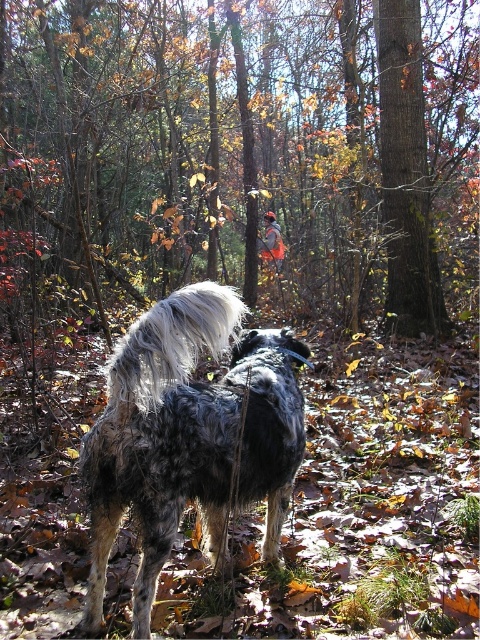
You are a hiker in the forest and you see the smooth bark tree at center and the spotted fur dog at center. Which one is closer to you?

The smooth bark tree at center is closer to you because the spotted fur dog at center is behind it.

You are a hiker who wants to take a photo of the spotted fur dog at center and the brown rough bark at center. Which one should you focus on first to ensure both are in the frame?

The spotted fur dog at center is closer to the viewer than the brown rough bark at center, so you should focus on the spotted fur dog at center first to ensure both are in the frame.